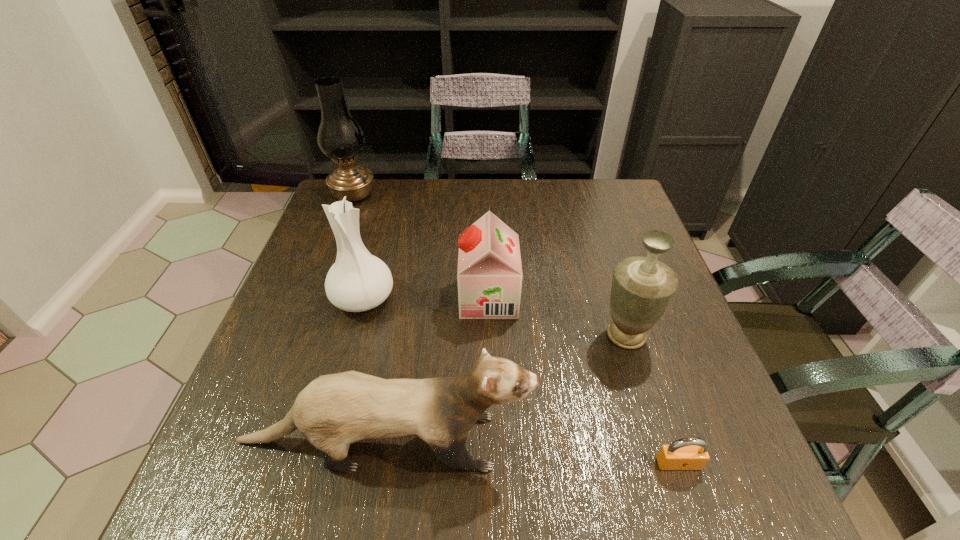
You are a GUI agent. You are given a task and a screenshot of the screen. Output one action in this format:
    pyautogui.click(x=<x>, y=<y>)
    Task: Click on the urn located in the right edge section of the desktop
    
    Given the screenshot: What is the action you would take?
    pyautogui.click(x=642, y=287)

Identify the location of padlock located in the right edge section of the desktop. (691, 453).

At what (x,y) coordinates should I click in order to perform the action: click on object that is at the far left corner. Please return your answer as a coordinate pair (x, y). Looking at the image, I should click on (340, 137).

At what (x,y) coordinates should I click in order to perform the action: click on object that is at the near left corner. Please return your answer as a coordinate pair (x, y). This screenshot has width=960, height=540. Looking at the image, I should click on (334, 410).

Identify the location of object situated at the near right corner. (691, 453).

Find the location of `vacant region at the far edge of the desktop`. vacant region at the far edge of the desktop is located at coordinates (527, 219).

Locate an element on the screen. free space at the near edge of the desktop is located at coordinates (478, 511).

You are a GUI agent. You are given a task and a screenshot of the screen. Output one action in this format:
    pyautogui.click(x=<x>, y=<y>)
    Task: Click on the vacant space at the left edge of the desktop
    The width and height of the screenshot is (960, 540).
    Given the screenshot: What is the action you would take?
    pyautogui.click(x=329, y=257)

Image resolution: width=960 pixels, height=540 pixels. In the image, there is a desktop. In order to click on vacant region at the right edge in this screenshot , I will do `click(669, 397)`.

Image resolution: width=960 pixels, height=540 pixels. In the image, there is a desktop. Find the location of `free space at the far right corner`. free space at the far right corner is located at coordinates (642, 221).